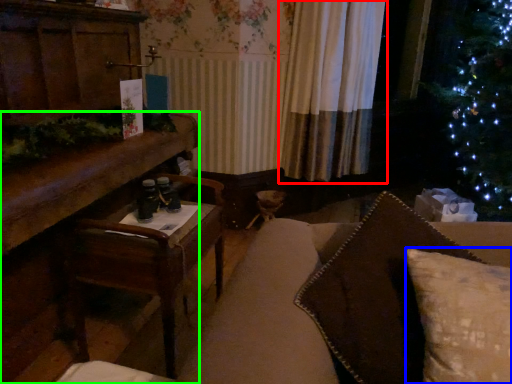
Question: Considering the real-world distances, which object is farthest from curtain (highlighted by a red box)? pillow (highlighted by a blue box) or furniture (highlighted by a green box)?

Choices:
 (A) pillow
 (B) furniture

Answer: (A)